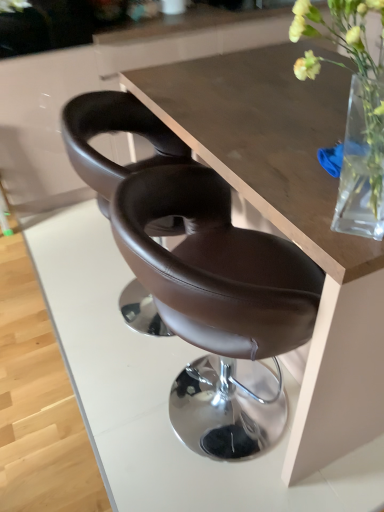
Question: From the image's perspective, is brown leather chair at center, the 2th chair when ordered from back to front, under white matte flower at upper center?

Choices:
 (A) no
 (B) yes

Answer: (B)

Question: From a real-world perspective, is brown leather chair at center, which is counted as the 1th chair, starting from the front, positioned over white matte flower at upper center based on gravity?

Choices:
 (A) yes
 (B) no

Answer: (B)

Question: Considering the relative positions of brown leather chair at center, the 2th chair when ordered from back to front, and white matte flower at upper center in the image provided, is brown leather chair at center, the 2th chair when ordered from back to front, behind white matte flower at upper center?

Choices:
 (A) no
 (B) yes

Answer: (A)

Question: Is brown leather chair at center, which is counted as the 1th chair, starting from the front, taller than white matte flower at upper center?

Choices:
 (A) yes
 (B) no

Answer: (A)

Question: Does brown leather chair at center, the 2th chair when ordered from back to front, have a lesser height compared to white matte flower at upper center?

Choices:
 (A) yes
 (B) no

Answer: (B)

Question: From the image's perspective, does brown leather chair at center, which is counted as the 1th chair, starting from the front, appear higher than white matte flower at upper center?

Choices:
 (A) yes
 (B) no

Answer: (B)

Question: From the image's perspective, is brown leather chair at center, the 2th chair when ordered from back to front, on top of brown leather chair at center, positioned as the 1th chair in back-to-front order?

Choices:
 (A) yes
 (B) no

Answer: (B)

Question: Considering the relative positions of brown leather chair at center, which is counted as the 1th chair, starting from the front, and brown leather chair at center, positioned as the 1th chair in back-to-front order, in the image provided, is brown leather chair at center, which is counted as the 1th chair, starting from the front, to the left of brown leather chair at center, positioned as the 1th chair in back-to-front order, from the viewer's perspective?

Choices:
 (A) no
 (B) yes

Answer: (A)

Question: Is brown leather chair at center, the 2th chair when ordered from back to front, facing away from brown leather chair at center, positioned as the 1th chair in back-to-front order?

Choices:
 (A) yes
 (B) no

Answer: (B)

Question: Does brown leather chair at center, which is counted as the 1th chair, starting from the front, have a lesser height compared to brown leather chair at center, the second chair viewed from the front?

Choices:
 (A) yes
 (B) no

Answer: (B)

Question: Does brown leather chair at center, the 2th chair when ordered from back to front, come in front of brown leather chair at center, the second chair viewed from the front?

Choices:
 (A) yes
 (B) no

Answer: (A)

Question: Is brown leather chair at center, which is counted as the 1th chair, starting from the front, aimed at brown leather chair at center, positioned as the 1th chair in back-to-front order?

Choices:
 (A) yes
 (B) no

Answer: (B)

Question: Is the surface of brown leather chair at center, which is counted as the 1th chair, starting from the front, in direct contact with wooden table at center?

Choices:
 (A) no
 (B) yes

Answer: (A)